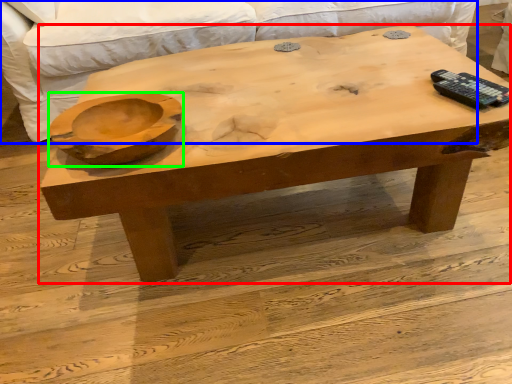
Question: Estimate the real-world distances between objects in this image. Which object is closer to coffee table (highlighted by a red box), couch (highlighted by a blue box) or bowl (highlighted by a green box)?

Choices:
 (A) couch
 (B) bowl

Answer: (B)